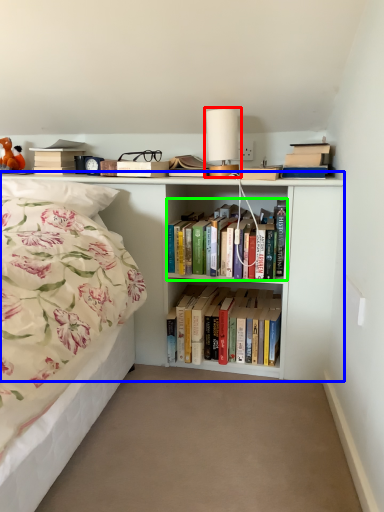
Question: Based on their relative distances, which object is farther from table lamp (highlighted by a red box)? Choose from bookcase (highlighted by a blue box) and book (highlighted by a green box).

Choices:
 (A) bookcase
 (B) book

Answer: (A)